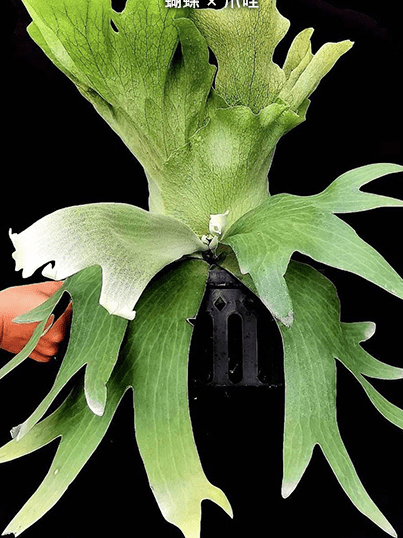
The height and width of the screenshot is (538, 403). What are the coordinates of `black diamond design on gray pot` in the screenshot? It's located at (221, 302), (247, 300).